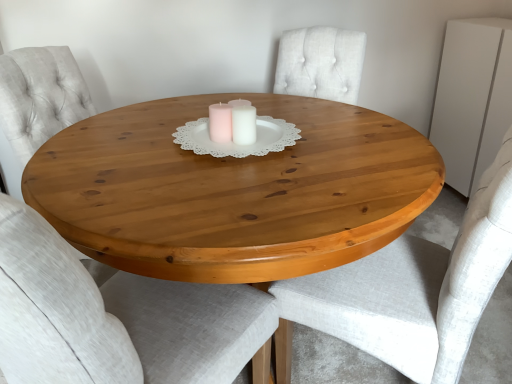
Locate an element on the screen. free spot above natural wood table at center (from a real-world perspective) is located at coordinates (151, 144).